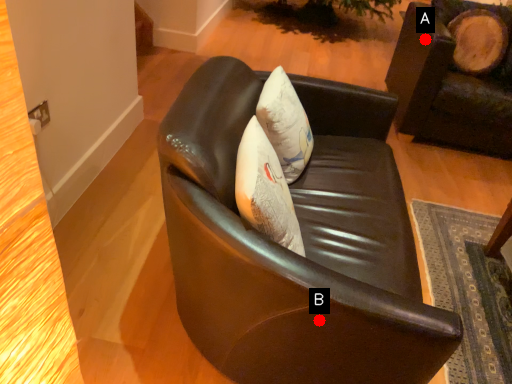
Question: Two points are circled on the image, labeled by A and B beside each circle. Which point is farther from the camera taking this photo?

Choices:
 (A) A is further
 (B) B is further

Answer: (A)